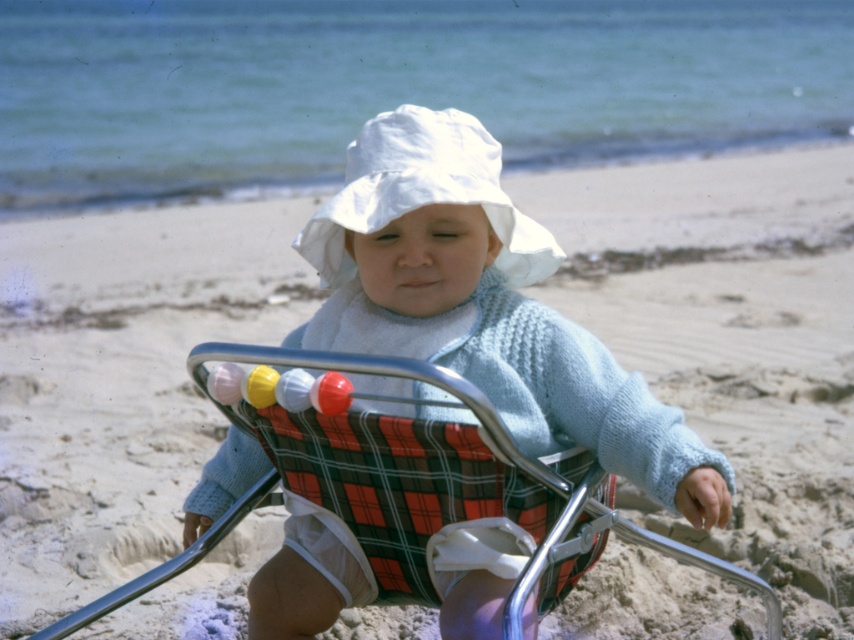
Question: Does white knitted sweater at center come behind plaid fabric baby carriage at center?

Choices:
 (A) yes
 (B) no

Answer: (A)

Question: Can you confirm if white knitted sweater at center is thinner than plaid fabric baby carriage at center?

Choices:
 (A) yes
 (B) no

Answer: (A)

Question: Is white knitted sweater at center thinner than plaid fabric baby carriage at center?

Choices:
 (A) yes
 (B) no

Answer: (A)

Question: Among these objects, which one is farthest from the camera?

Choices:
 (A) plaid fabric baby carriage at center
 (B) white knitted sweater at center

Answer: (B)

Question: Which of the following is the closest to the observer?

Choices:
 (A) (442, 163)
 (B) (626, 531)

Answer: (A)